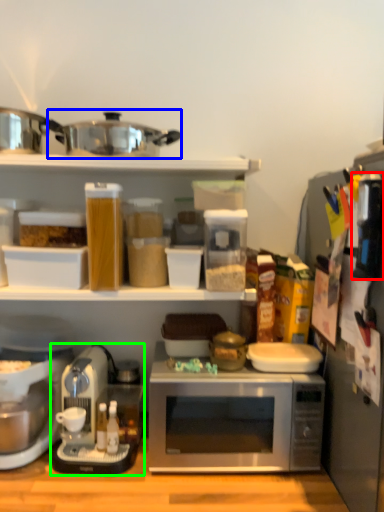
Question: Estimate the real-world distances between objects in this image. Which object is farther from appliance (highlighted by a red box), crock pot (highlighted by a blue box) or coffee maker (highlighted by a green box)?

Choices:
 (A) crock pot
 (B) coffee maker

Answer: (B)